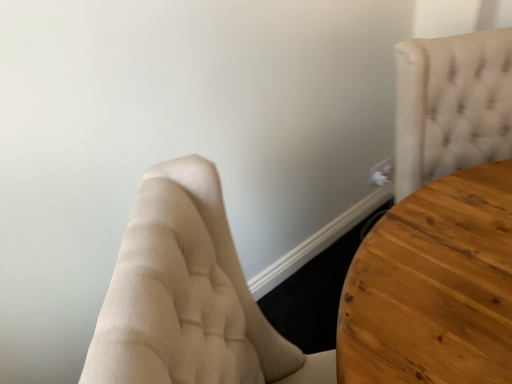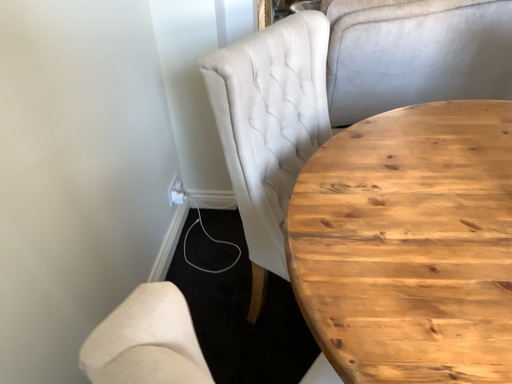
Question: Which way did the camera rotate in the video?

Choices:
 (A) rotated left
 (B) rotated right

Answer: (B)